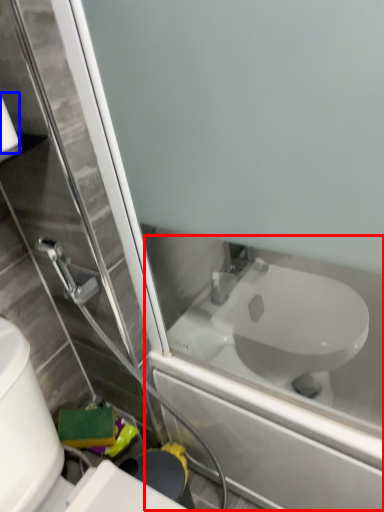
Question: Which object is closer to the camera taking this photo, bath (highlighted by a red box) or toilet paper (highlighted by a blue box)?

Choices:
 (A) bath
 (B) toilet paper

Answer: (B)